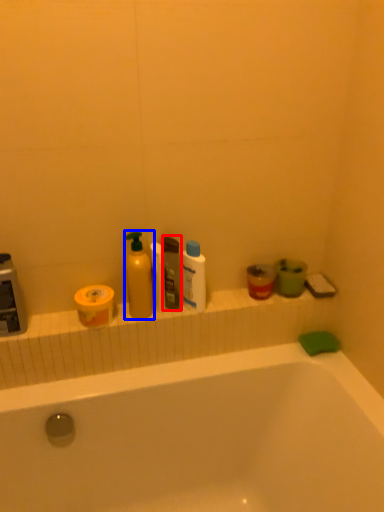
Question: Which of the following is the farthest to the observer, toiletry (highlighted by a red box) or cleaning product (highlighted by a blue box)?

Choices:
 (A) toiletry
 (B) cleaning product

Answer: (A)